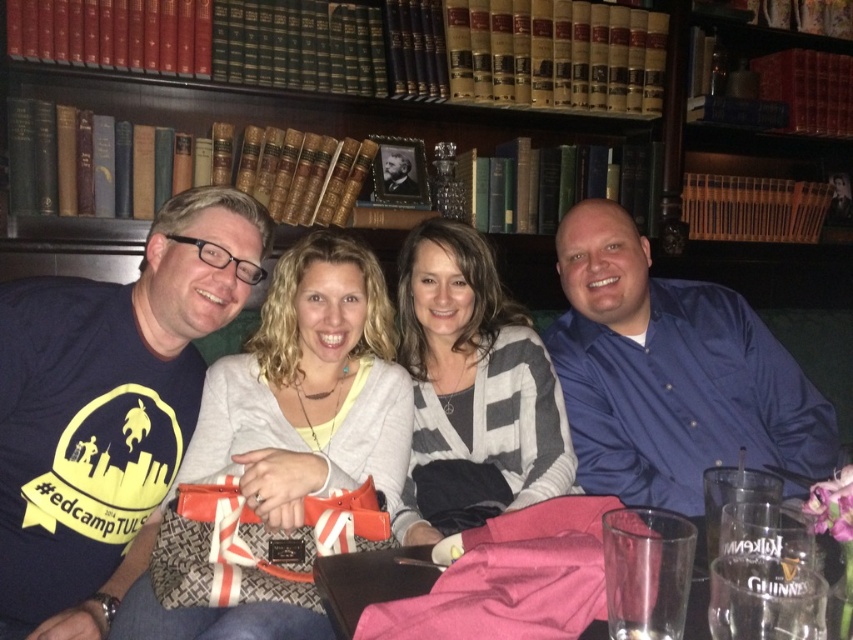
You are standing 5 feet away from the bookshelf in the image. Can you reach the point at coordinates point [350,317] without moving closer?

The distance of point [350,317] from viewer is 4.75 feet, so yes, you can reach the point at coordinates point [350,317] without moving closer since it is within your current distance of 5 feet.

You are a photographer setting up a photo shoot in a cozy indoor setting with a large bookshelf in the background. You notice two shirts hanging on a rack nearby. One is a matte black shirt at left and the other is a blue satin shirt at right. The shirts are positioned such that they might block the view of the bookshelf if they are too wide. Can you determine which shirt is more likely to block the bookshelf view based on their widths?

The matte black shirt at left might be wider than blue satin shirt at right, so it is more likely to block the bookshelf view if hung in front of it compared to the blue satin shirt at right.